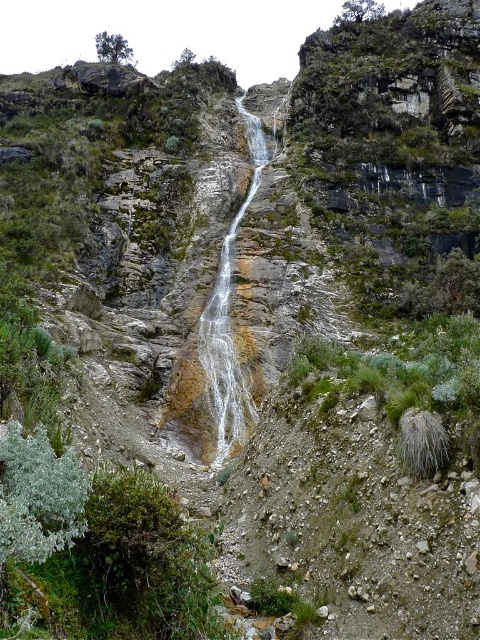
You are standing 30 meters away from the green fuzzy bush at lower left. Can you safely walk towards it without crossing any obstacles?

The green fuzzy bush at lower left is 33.65 meters away from you, so you are currently 30 meters away. This means you are still 3.65 meters away from the bush and can safely walk towards it without crossing any obstacles.

You are a hiker who wants to take a photo of the waterfall. You have a camera that can only focus on objects within 3 meters. Are both the green fuzzy bush at lower left and the green leafy shrub at upper center within the camera focus range?

The green fuzzy bush at lower left has a lesser height compared to the green leafy shrub at upper center, but the focus range depends on distance, not height. Since the scene description doesn not provide information about their distances from the camera, it is impossible to determine if they are within the 3 meters focus range.

You are standing at the edge of the waterfall and want to take a photo of the clear water at center and the green leafy shrub at upper center. Which object will appear closer to the camera in the photo?

The clear water at center appears closer to the camera because it is in front of the green leafy shrub at upper center.